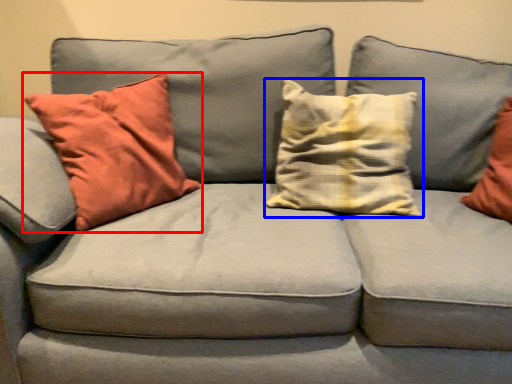
Question: Among these objects, which one is nearest to the camera, pillow (highlighted by a red box) or pillow (highlighted by a blue box)?

Choices:
 (A) pillow
 (B) pillow

Answer: (A)